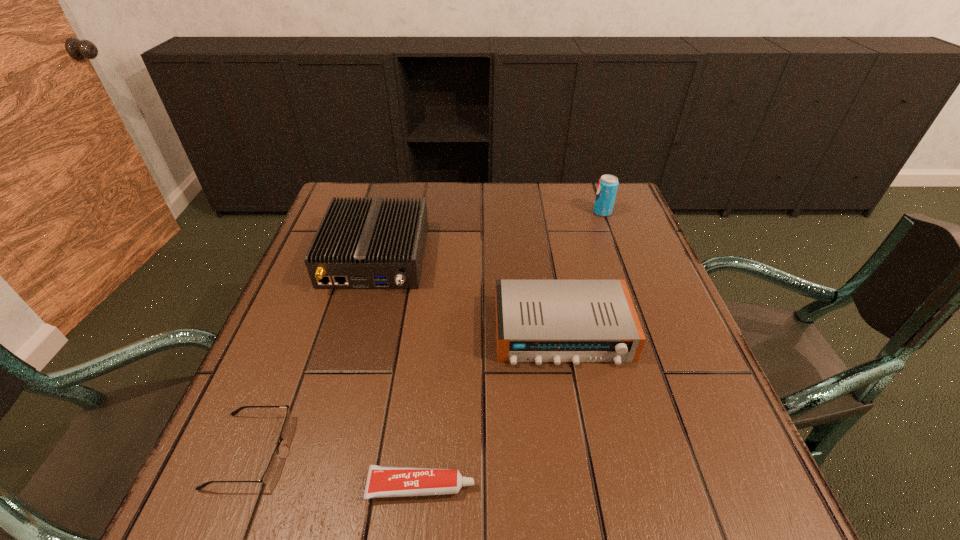
This screenshot has width=960, height=540. What are the coordinates of `free space located 0.090m on the front-facing side of the spectacles` in the screenshot? It's located at (339, 450).

Identify the location of free space located 0.400m at the nozzle of the toothpaste. (726, 486).

At what (x,y) coordinates should I click in order to perform the action: click on soda can that is positioned at the far edge. Please return your answer as a coordinate pair (x, y). This screenshot has width=960, height=540. Looking at the image, I should click on (607, 188).

Where is `router located in the far edge section of the desktop`? The height and width of the screenshot is (540, 960). router located in the far edge section of the desktop is located at coordinates (360, 244).

Find the location of a particular element. The image size is (960, 540). spectacles that is at the near edge is located at coordinates (273, 464).

Locate an element on the screen. Image resolution: width=960 pixels, height=540 pixels. toothpaste situated at the near edge is located at coordinates (382, 481).

I want to click on router present at the left edge, so click(360, 244).

The height and width of the screenshot is (540, 960). What are the coordinates of `spectacles that is at the left edge` in the screenshot? It's located at (273, 464).

Identify the location of soda can located in the right edge section of the desktop. (607, 188).

Locate an element on the screen. radio receiver that is at the right edge is located at coordinates (557, 321).